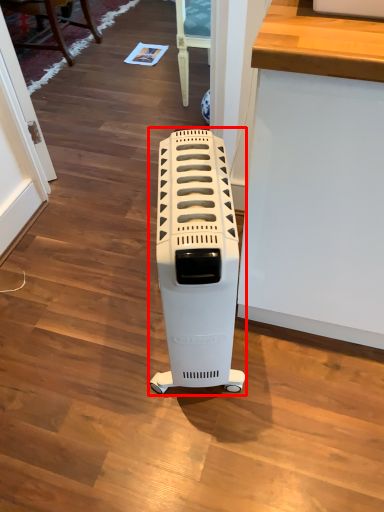
Question: In this image, where is home appliance (annotated by the red box) located relative to furniture?

Choices:
 (A) right
 (B) left

Answer: (A)